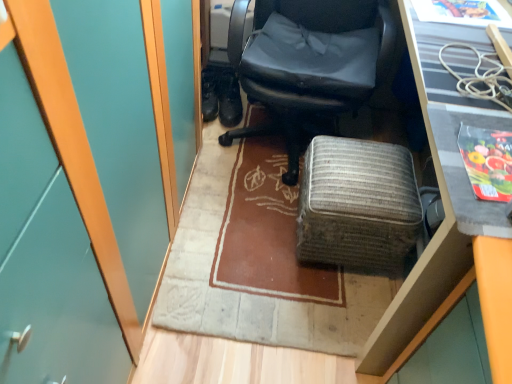
The image size is (512, 384). What do you see at coordinates (209, 93) in the screenshot? I see `black leather shoes at lower left, arranged as the 2th footwear when viewed from the right` at bounding box center [209, 93].

Identify the location of black textured desk at upper right. (466, 172).

From the image's perspective, is black leather shoes at lower left, the 1th footwear positioned from the left, above or below black textured desk at upper right?

black leather shoes at lower left, the 1th footwear positioned from the left, is above black textured desk at upper right.

The height and width of the screenshot is (384, 512). I want to click on desk in front of the black leather shoes at lower left, the 1th footwear positioned from the left, so click(466, 172).

Considering the relative sizes of black leather shoes at lower left, arranged as the 2th footwear when viewed from the right, and black textured desk at upper right in the image provided, is black leather shoes at lower left, arranged as the 2th footwear when viewed from the right, thinner than black textured desk at upper right?

Indeed, black leather shoes at lower left, arranged as the 2th footwear when viewed from the right, has a lesser width compared to black textured desk at upper right.

Visually, is black leather shoes at lower left, the 1th footwear positioned from the left, positioned to the left or to the right of black textured desk at upper right?

Clearly, black leather shoes at lower left, the 1th footwear positioned from the left, is on the left of black textured desk at upper right in the image.

Does black leather boot at center, which is the first footwear from right to left, contain black textured desk at upper right?

No, black textured desk at upper right is located outside of black leather boot at center, which is the first footwear from right to left.

I want to click on the 2nd footwear located beneath the black textured desk at upper right (from a real-world perspective), so click(x=229, y=100).

Is black leather boot at center, acting as the second footwear starting from the left, at the right side of black textured desk at upper right?

In fact, black leather boot at center, acting as the second footwear starting from the left, is to the left of black textured desk at upper right.

In the scene shown: Is black leather boot at center, acting as the second footwear starting from the left, wider than black textured desk at upper right?

No, black leather boot at center, acting as the second footwear starting from the left, is not wider than black textured desk at upper right.

Considering the positions of objects woven fabric ottoman at center and black textured desk at upper right in the image provided, who is more to the right, woven fabric ottoman at center or black textured desk at upper right?

From the viewer's perspective, black textured desk at upper right appears more on the right side.

Is woven fabric ottoman at center not within black textured desk at upper right?

That's incorrect, woven fabric ottoman at center is not completely outside black textured desk at upper right.

What are the coordinates of `furniture located on the left of black textured desk at upper right` in the screenshot? It's located at (357, 204).

Does woven fabric ottoman at center touch black textured desk at upper right?

No, woven fabric ottoman at center is not touching black textured desk at upper right.

From the image's perspective, which is below, black leather shoes at lower left, arranged as the 2th footwear when viewed from the right, or matte black office chair at center?

black leather shoes at lower left, arranged as the 2th footwear when viewed from the right.

Considering the positions of point (203, 70) and point (294, 36), is point (203, 70) closer or farther from the camera than point (294, 36)?

Point (203, 70) is positioned farther from the camera compared to point (294, 36).

Who is shorter, black leather shoes at lower left, the 1th footwear positioned from the left, or matte black office chair at center?

With less height is black leather shoes at lower left, the 1th footwear positioned from the left.

Considering their positions, is matte black office chair at center located in front of or behind woven fabric ottoman at center?

Clearly, matte black office chair at center is in front of woven fabric ottoman at center.

Considering the sizes of matte black office chair at center and woven fabric ottoman at center in the image, is matte black office chair at center taller or shorter than woven fabric ottoman at center?

In the image, matte black office chair at center appears to be taller than woven fabric ottoman at center.

Is woven fabric ottoman at center surrounded by matte black office chair at center?

No, woven fabric ottoman at center is not surrounded by matte black office chair at center.

From the image's perspective, which object appears higher, black leather boot at center, acting as the second footwear starting from the left, or black leather shoes at lower left, arranged as the 2th footwear when viewed from the right?

black leather shoes at lower left, arranged as the 2th footwear when viewed from the right.

Which is more to the right, black leather boot at center, which is the first footwear from right to left, or black leather shoes at lower left, arranged as the 2th footwear when viewed from the right?

Positioned to the right is black leather boot at center, which is the first footwear from right to left.

Is black leather shoes at lower left, arranged as the 2th footwear when viewed from the right, completely or partially inside black leather boot at center, which is the first footwear from right to left?

No, black leather shoes at lower left, arranged as the 2th footwear when viewed from the right, is located outside of black leather boot at center, which is the first footwear from right to left.

Is black leather shoes at lower left, the 1th footwear positioned from the left, completely or partially inside woven fabric ottoman at center?

No, black leather shoes at lower left, the 1th footwear positioned from the left, is not inside woven fabric ottoman at center.

From the image's perspective, is woven fabric ottoman at center on top of black leather shoes at lower left, arranged as the 2th footwear when viewed from the right?

No, from the image's perspective, woven fabric ottoman at center is not on top of black leather shoes at lower left, arranged as the 2th footwear when viewed from the right.

Is woven fabric ottoman at center far away from black leather shoes at lower left, arranged as the 2th footwear when viewed from the right?

woven fabric ottoman at center is near black leather shoes at lower left, arranged as the 2th footwear when viewed from the right, not far away.

Is woven fabric ottoman at center in front of or behind black leather shoes at lower left, arranged as the 2th footwear when viewed from the right, in the image?

Visually, woven fabric ottoman at center is located in front of black leather shoes at lower left, arranged as the 2th footwear when viewed from the right.

The image size is (512, 384). I want to click on desk on the right of black leather shoes at lower left, the 1th footwear positioned from the left, so click(466, 172).

This screenshot has width=512, height=384. In order to click on the 1st footwear to the left when counting from the black textured desk at upper right in this screenshot , I will do `click(229, 100)`.

Considering their positions, is black leather boot at center, acting as the second footwear starting from the left, positioned further to matte black office chair at center than black textured desk at upper right?

black textured desk at upper right lies further to matte black office chair at center than the other object.

Based on their spatial positions, is black textured desk at upper right or matte black office chair at center further from woven fabric ottoman at center?

Among the two, black textured desk at upper right is located further to woven fabric ottoman at center.

Which object lies nearer to the anchor point woven fabric ottoman at center, black leather shoes at lower left, the 1th footwear positioned from the left, or black textured desk at upper right?

Among the two, black textured desk at upper right is located nearer to woven fabric ottoman at center.

Consider the image. Estimate the real-world distances between objects in this image. Which object is further from woven fabric ottoman at center, black textured desk at upper right or black leather boot at center, acting as the second footwear starting from the left?

Among the two, black leather boot at center, acting as the second footwear starting from the left, is located further to woven fabric ottoman at center.

Estimate the real-world distances between objects in this image. Which object is further from black leather boot at center, acting as the second footwear starting from the left, black textured desk at upper right or black leather shoes at lower left, arranged as the 2th footwear when viewed from the right?

black textured desk at upper right lies further to black leather boot at center, acting as the second footwear starting from the left, than the other object.

Considering their positions, is woven fabric ottoman at center positioned further to matte black office chair at center than black leather boot at center, which is the first footwear from right to left?

Among the two, black leather boot at center, which is the first footwear from right to left, is located further to matte black office chair at center.

Estimate the real-world distances between objects in this image. Which object is closer to woven fabric ottoman at center, black textured desk at upper right or black leather shoes at lower left, the 1th footwear positioned from the left?

The object closer to woven fabric ottoman at center is black textured desk at upper right.

Based on their spatial positions, is black leather boot at center, acting as the second footwear starting from the left, or black leather shoes at lower left, the 1th footwear positioned from the left, closer to matte black office chair at center?

black leather boot at center, acting as the second footwear starting from the left.

Locate an element on the screen. furniture positioned between black textured desk at upper right and black leather boot at center, which is the first footwear from right to left, from near to far is located at coordinates (357, 204).

Locate an element on the screen. The height and width of the screenshot is (384, 512). chair located between black textured desk at upper right and black leather boot at center, acting as the second footwear starting from the left, in the depth direction is located at coordinates (308, 62).

This screenshot has height=384, width=512. What are the coordinates of `furniture between matte black office chair at center and black leather boot at center, which is the first footwear from right to left, from front to back` in the screenshot? It's located at (357, 204).

The image size is (512, 384). Identify the location of chair between black textured desk at upper right and black leather shoes at lower left, arranged as the 2th footwear when viewed from the right, from front to back. (308, 62).